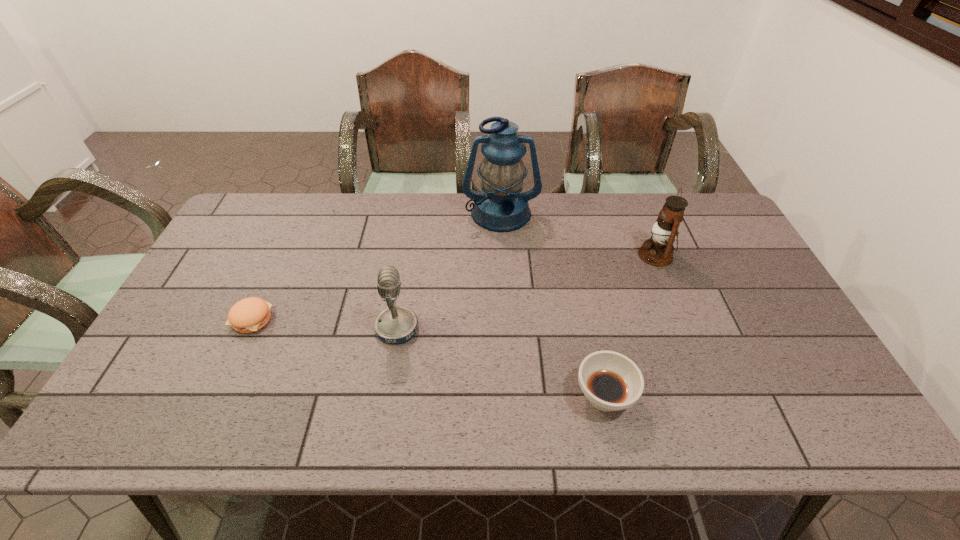
What are the coordinates of `the taller lantern` in the screenshot? It's located at (501, 206).

This screenshot has width=960, height=540. I want to click on the third object from left to right, so click(x=501, y=206).

Where is `the fourth nearest object`? Image resolution: width=960 pixels, height=540 pixels. the fourth nearest object is located at coordinates 658,251.

Locate an element on the screen. the shorter lantern is located at coordinates (658, 251).

Where is `the fourth object from right to left`? the fourth object from right to left is located at coordinates (397, 324).

This screenshot has width=960, height=540. In order to click on soup bowl in this screenshot , I will do `click(610, 381)`.

This screenshot has width=960, height=540. Find the location of `the nearest object`. the nearest object is located at coordinates (610, 381).

Find the location of `the shortest object`. the shortest object is located at coordinates (248, 315).

You are a GUI agent. You are given a task and a screenshot of the screen. Output one action in this format:
    pyautogui.click(x=<x>, y=<y>)
    Task: Click on the leftmost object
    The width and height of the screenshot is (960, 540).
    Given the screenshot: What is the action you would take?
    pyautogui.click(x=248, y=315)

The image size is (960, 540). I want to click on vacant space situated 0.140m on the face of the taller lantern, so click(504, 262).